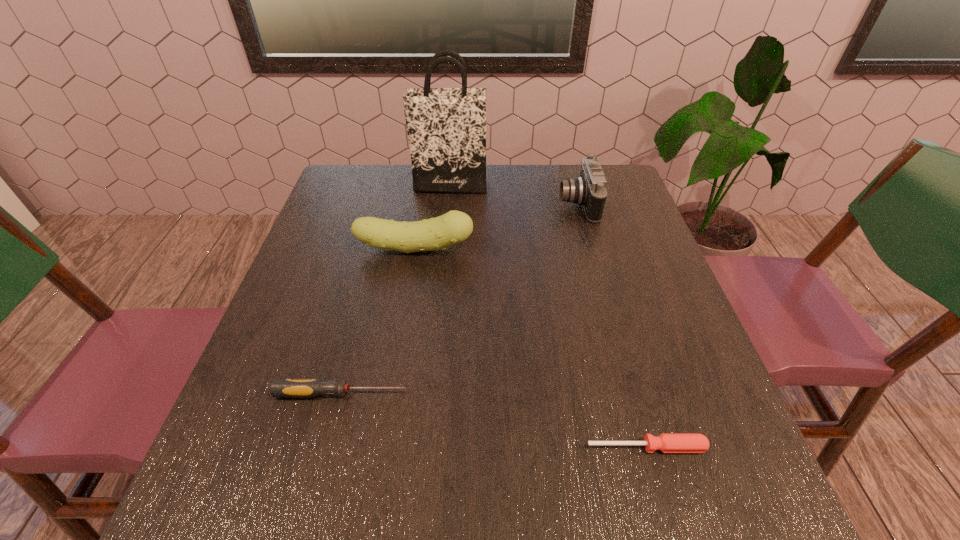
This screenshot has height=540, width=960. What are the coordinates of `free space that satisfies the following two spatial constraints: 1. on the front of the shopping bag with the design; 2. insert the farther screwdriver into a screw head` in the screenshot? It's located at (431, 393).

The image size is (960, 540). I want to click on vacant space that satisfies the following two spatial constraints: 1. insert the shortest object into a screw head; 2. on the right side of the second nearest object, so click(x=328, y=447).

Locate an element on the screen. Image resolution: width=960 pixels, height=540 pixels. free space that satisfies the following two spatial constraints: 1. insert the right screwdriver into a screw head; 2. on the right side of the second shortest object is located at coordinates (328, 447).

I want to click on vacant space that satisfies the following two spatial constraints: 1. on the front-facing side of the nearer screwdriver; 2. on the right side of the camera, so click(644, 447).

Locate an element on the screen. vacant area that satisfies the following two spatial constraints: 1. insert the second nearest object into a screw head; 2. on the left side of the right screwdriver is located at coordinates (328, 447).

Locate an element on the screen. The image size is (960, 540). vacant space that satisfies the following two spatial constraints: 1. insert the nearer screwdriver into a screw head; 2. on the left side of the second shortest object is located at coordinates (328, 447).

Where is `free space in the image that satisfies the following two spatial constraints: 1. on the front-facing side of the camera; 2. on the front side of the third farthest object`? free space in the image that satisfies the following two spatial constraints: 1. on the front-facing side of the camera; 2. on the front side of the third farthest object is located at coordinates (590, 249).

In order to click on vacant space that satisfies the following two spatial constraints: 1. on the front-facing side of the shortest object; 2. on the left side of the camera in this screenshot , I will do `click(644, 447)`.